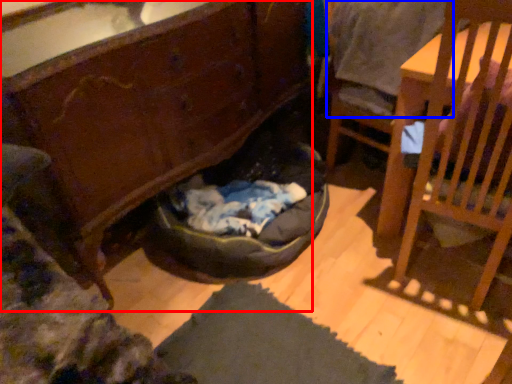
Question: Which point is further to the camera, cabinetry (highlighted by a red box) or clothing (highlighted by a blue box)?

Choices:
 (A) cabinetry
 (B) clothing

Answer: (B)